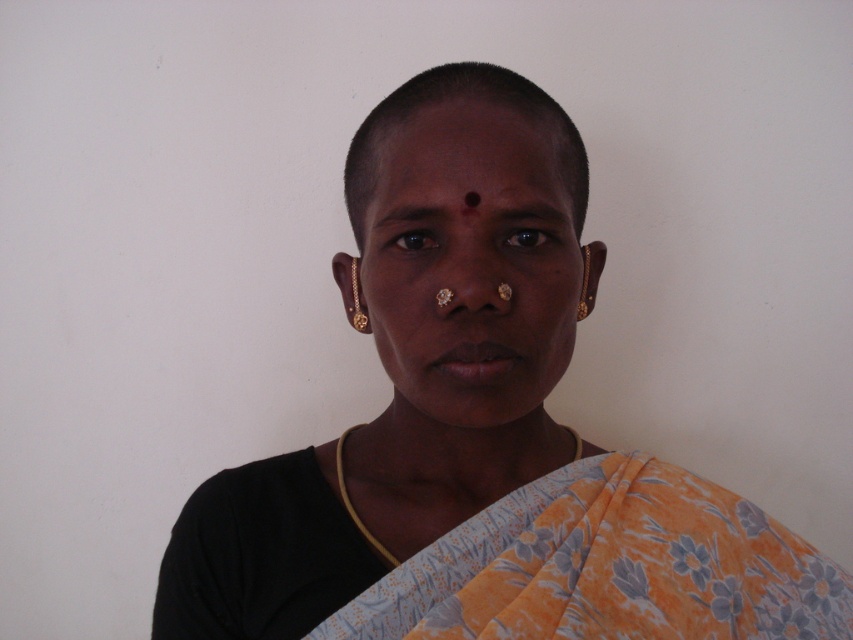
Question: Which point is closer to the camera?

Choices:
 (A) matte black blouse at center
 (B) brown smooth eyebrow at upper center
 (C) matte skin at center
 (D) brown matte eyebrow at upper center

Answer: (A)

Question: Can you confirm if matte black blouse at center is thinner than floral orange sari at lower center?

Choices:
 (A) yes
 (B) no

Answer: (B)

Question: Estimate the real-world distances between objects in this image. Which object is farther from the brown smooth eyebrow at upper center?

Choices:
 (A) brown matte eyebrow at upper center
 (B) matte skin at center
 (C) matte black blouse at center
 (D) floral orange sari at lower center

Answer: (D)

Question: Does matte black blouse at center appear under brown matte eyebrow at upper center?

Choices:
 (A) yes
 (B) no

Answer: (A)

Question: Which is nearer to the brown smooth eyebrow at upper center?

Choices:
 (A) brown matte eyebrow at upper center
 (B) matte skin at center
 (C) matte gold nose ring at center

Answer: (A)

Question: Is the position of matte black blouse at center more distant than that of floral orange sari at lower center?

Choices:
 (A) yes
 (B) no

Answer: (B)